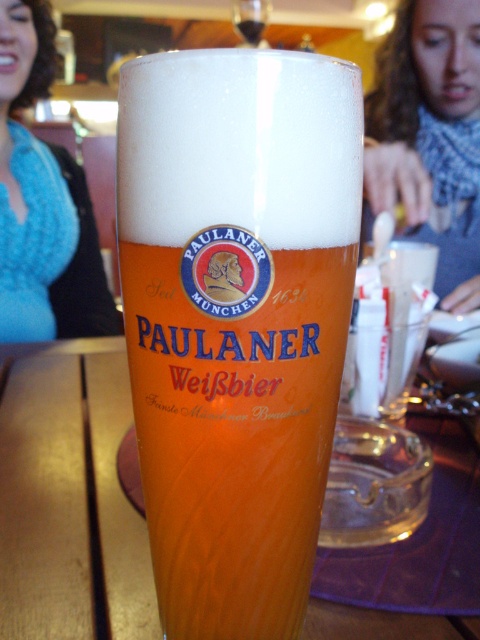
You are a bartender preparing to place a coaster under the Paulaner Weissebier glass. The coaster has a diameter of 10 cm. The point at coordinates (236, 320) marks the center of the glass. Is there enough space on the table around the glass to place the coaster without overlapping the glass?

The point at coordinates (236, 320) marks the center of the matte glass beer at center. Since the coaster has a diameter of 10 cm, placing it centered at the glass would mean the coaster would overlap the glass itself. Therefore, the coaster cannot be placed there without overlapping the glass.